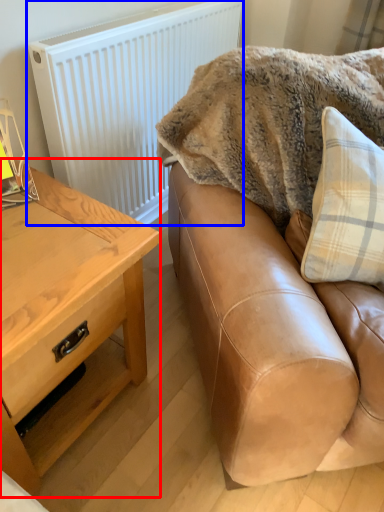
Question: Among these objects, which one is nearest to the camera, table (highlighted by a red box) or radiator (highlighted by a blue box)?

Choices:
 (A) table
 (B) radiator

Answer: (A)